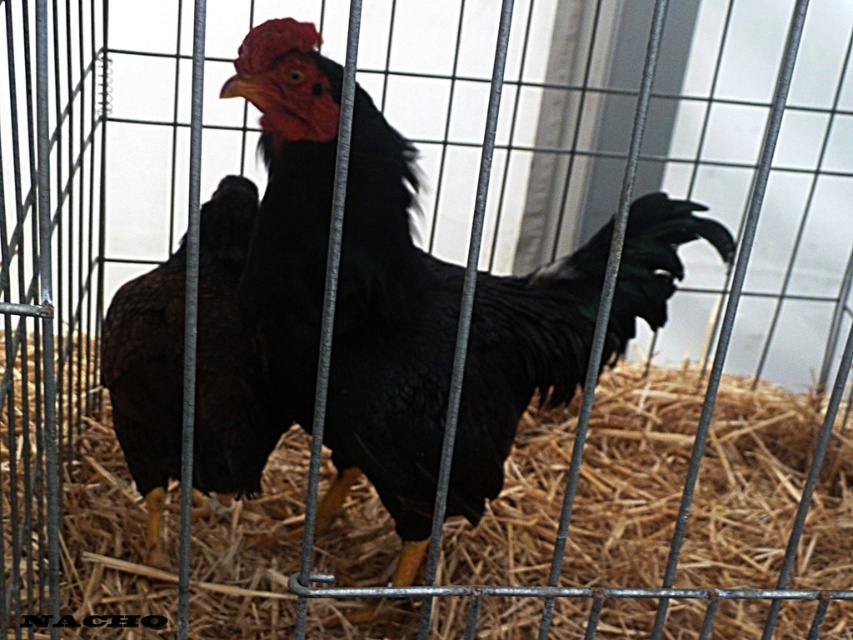
In order to click on shiny black rooster at center in this screenshot , I will do `click(387, 340)`.

Which of these two, shiny black rooster at center or brown feathered chicken at center, stands shorter?

With less height is brown feathered chicken at center.

Who is more forward, (297, 396) or (215, 458)?

Point (297, 396) is in front.

Locate an element on the screen. shiny black rooster at center is located at coordinates (387, 340).

Locate an element on the screen. brown straw at center is located at coordinates (630, 492).

Is brown straw at center further to the viewer compared to brown feathered chicken at center?

No, brown straw at center is closer to the viewer.

Locate an element on the screen. This screenshot has height=640, width=853. brown straw at center is located at coordinates (630, 492).

Is brown straw at center above shiny black rooster at center?

Incorrect, brown straw at center is not positioned above shiny black rooster at center.

Locate an element on the screen. brown straw at center is located at coordinates (630, 492).

The height and width of the screenshot is (640, 853). What do you see at coordinates (630, 492) in the screenshot? I see `brown straw at center` at bounding box center [630, 492].

The image size is (853, 640). Identify the location of brown straw at center. (630, 492).